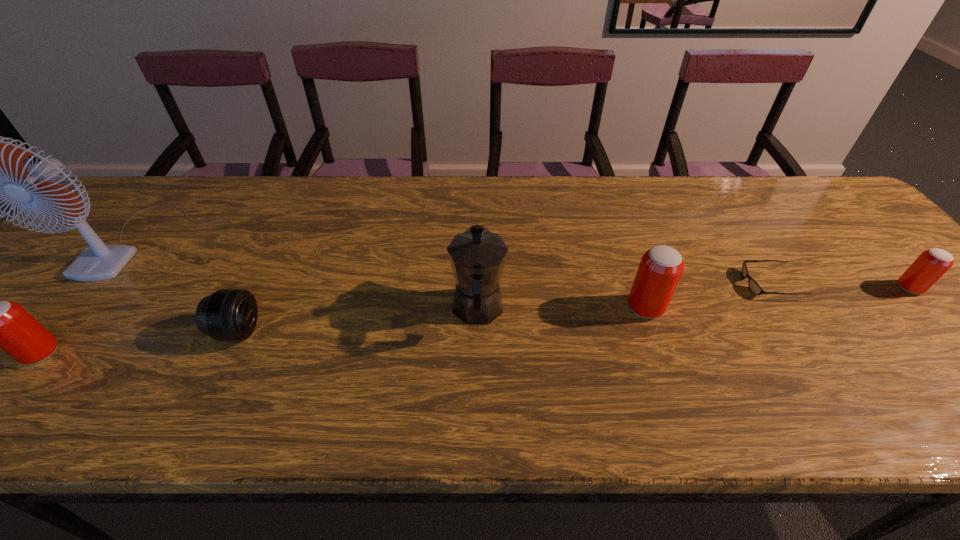
Identify the location of vacant region located 0.180m on the pouring side of the fourth object from right to left. The image size is (960, 540). (478, 232).

Where is `vacant position located 0.260m on the pouring side of the fourth object from right to left`? The width and height of the screenshot is (960, 540). vacant position located 0.260m on the pouring side of the fourth object from right to left is located at coordinates (478, 215).

The image size is (960, 540). In order to click on free location located on the pouring side of the fourth object from right to left in this screenshot , I will do `click(478, 257)`.

What are the coordinates of `object located at the far edge` in the screenshot? It's located at (97, 262).

Where is `beer can present at the near edge`? This screenshot has width=960, height=540. beer can present at the near edge is located at coordinates (3, 324).

At what (x,y) coordinates should I click in order to perform the action: click on telephoto lens present at the near edge. Please return your answer as a coordinate pair (x, y). The image size is (960, 540). Looking at the image, I should click on (228, 314).

I want to click on beer can present at the left edge, so click(3, 324).

Where is `fan positioned at the left edge`? This screenshot has height=540, width=960. fan positioned at the left edge is located at coordinates (97, 262).

Identify the location of object that is at the right edge. The width and height of the screenshot is (960, 540). (932, 264).

This screenshot has width=960, height=540. I want to click on object that is positioned at the far left corner, so click(97, 262).